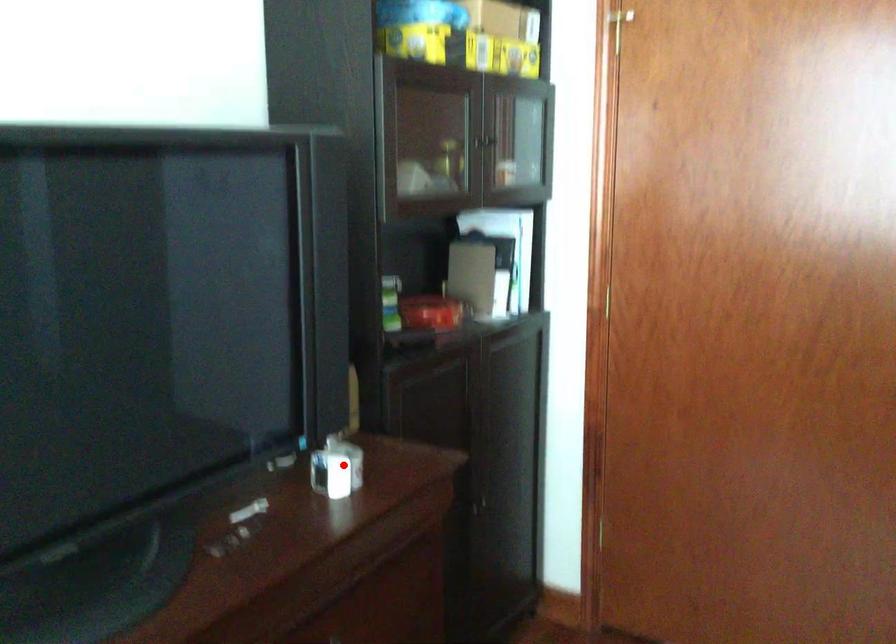
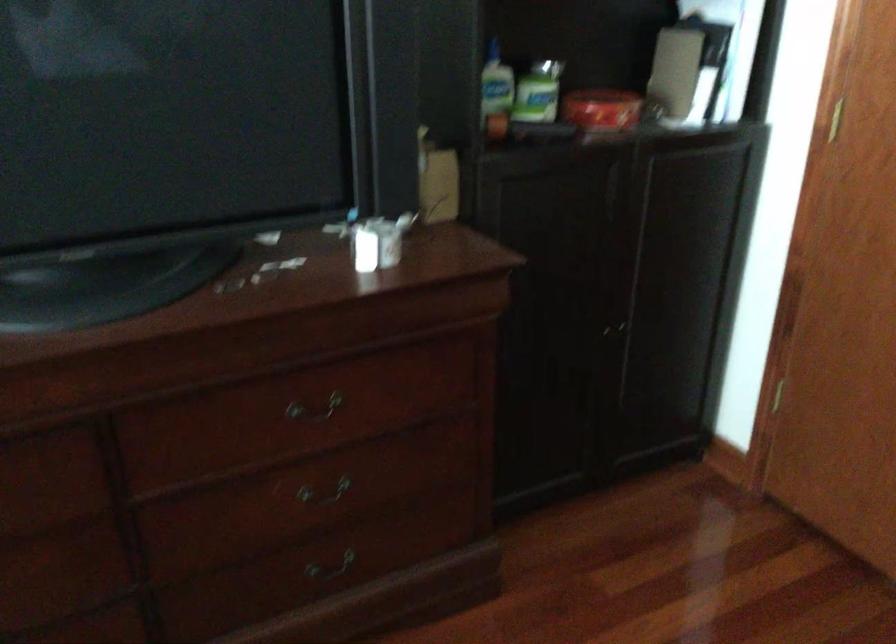
The point at the highlighted location is marked in the first image. Where is the corresponding point in the second image?

(378, 242)